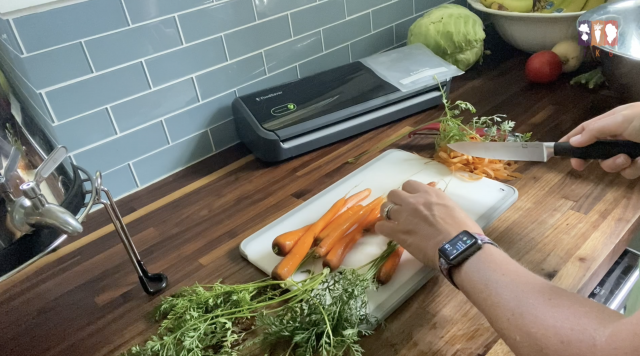
Find the location of a particular element. The width and height of the screenshot is (640, 356). brown counter top is located at coordinates (209, 229).